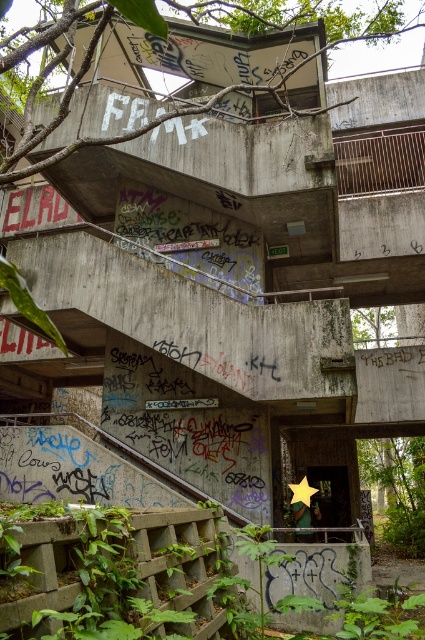
Can you confirm if green leafy plants at lower left is wider than green leafy vegetation at lower right?

Incorrect, green leafy plants at lower left's width does not surpass green leafy vegetation at lower right's.

Which of these two, green leafy plants at lower left or green leafy vegetation at lower right, stands taller?

Standing taller between the two is green leafy vegetation at lower right.

Where is `green leafy plants at lower left`? green leafy plants at lower left is located at coordinates (173, 579).